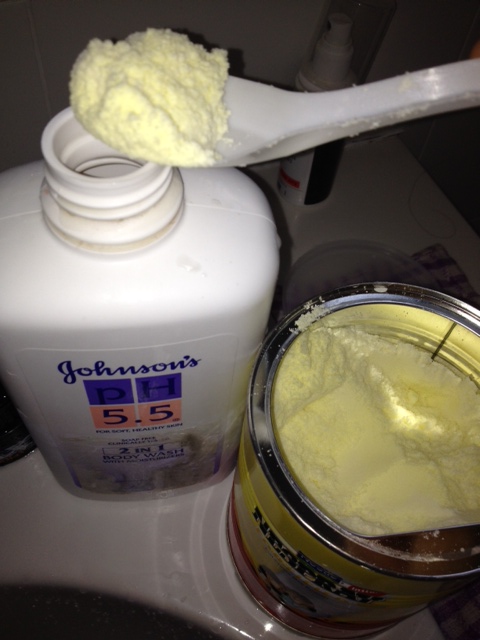
Locate an element on the screen. white table is located at coordinates (408, 219).